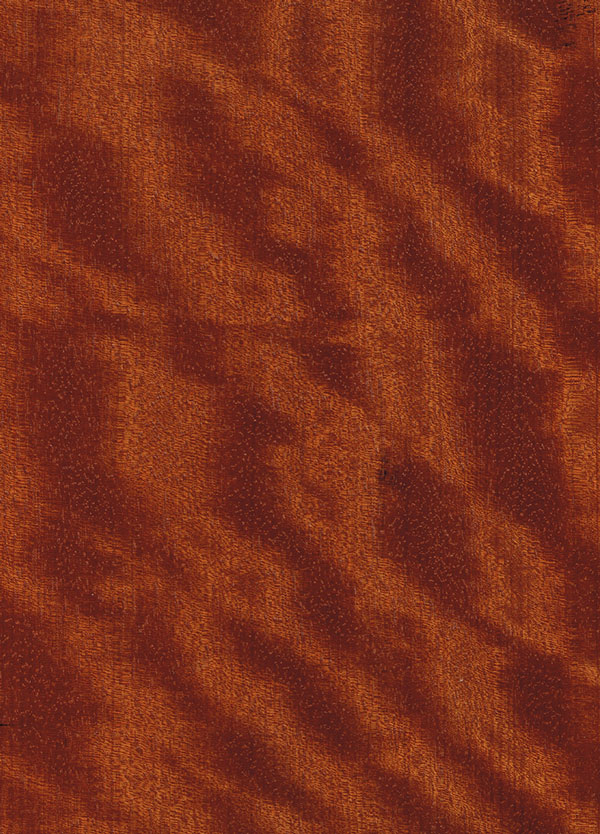
This screenshot has width=600, height=834. I want to click on empty space top of blanket, so click(271, 43).